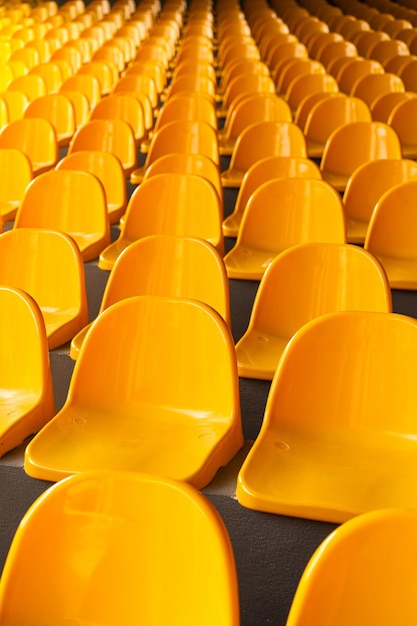
Where is `chair bolts`? This screenshot has height=626, width=417. chair bolts is located at coordinates (76, 419), (14, 414), (207, 437), (281, 444), (260, 337), (242, 250).